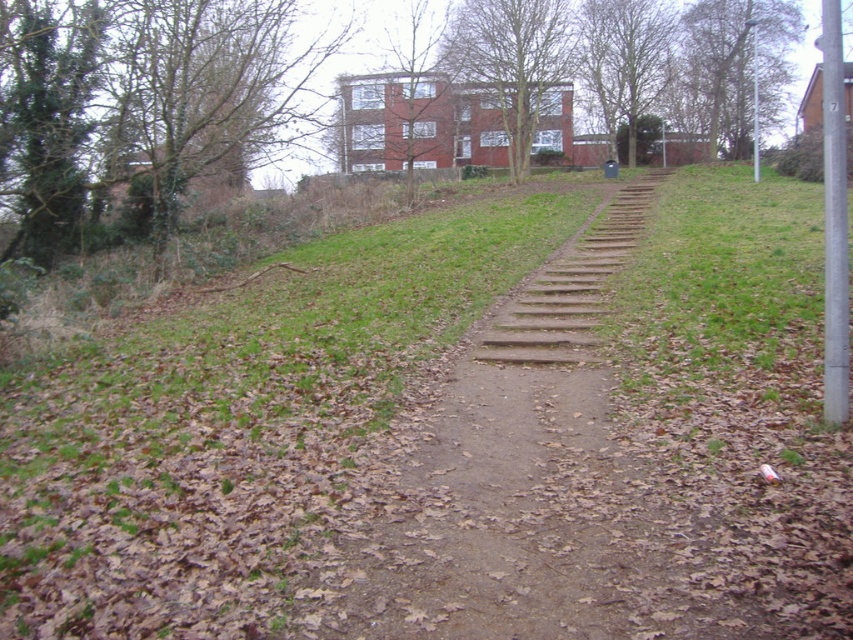
Can you confirm if green grassy at center is wider than wooden stairs at center?

Indeed, green grassy at center has a greater width compared to wooden stairs at center.

Is green grassy at center positioned behind wooden stairs at center?

That is False.

Is point (631, 541) positioned in front of point (596, 282)?

Yes, point (631, 541) is closer to viewer.

I want to click on green grassy at center, so click(450, 442).

Who is more forward, (772,620) or (363,598)?

Point (772,620)

This screenshot has height=640, width=853. I want to click on green grassy at center, so click(450, 442).

At what (x,y) coordinates should I click in order to perform the action: click on dirt path at center. Please return your answer as a coordinate pair (x, y). Looking at the image, I should click on (497, 468).

Is dirt path at center taller than wooden stairs at center?

No, dirt path at center is not taller than wooden stairs at center.

This screenshot has height=640, width=853. Describe the element at coordinates (497, 468) in the screenshot. I see `dirt path at center` at that location.

The height and width of the screenshot is (640, 853). I want to click on dirt path at center, so click(497, 468).